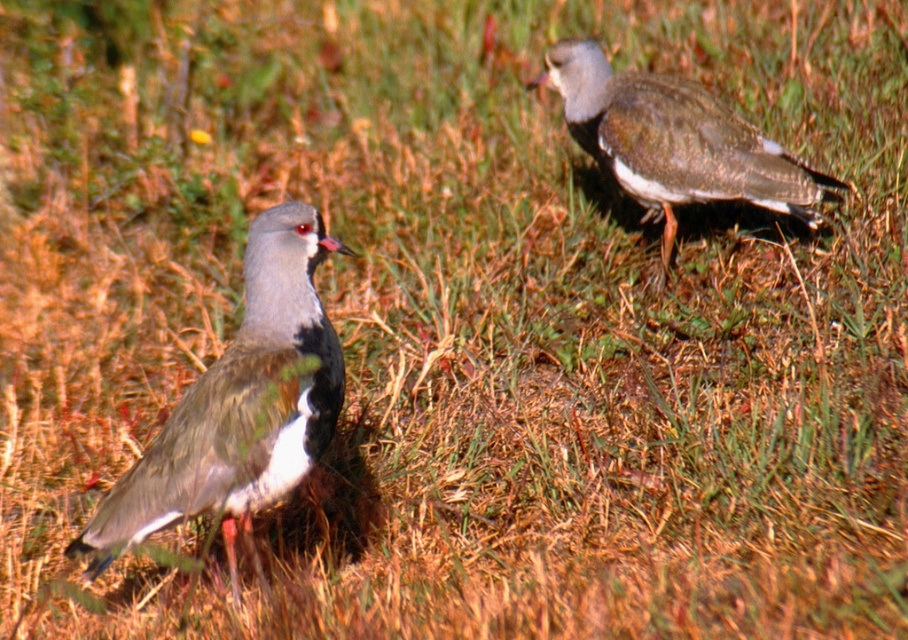
Which is more to the right, brown speckled feathers at left or brown speckled feathers at upper right?

brown speckled feathers at upper right is more to the right.

This screenshot has height=640, width=908. What do you see at coordinates (240, 406) in the screenshot?
I see `brown speckled feathers at left` at bounding box center [240, 406].

Find the location of `brown speckled feathers at left`. brown speckled feathers at left is located at coordinates (240, 406).